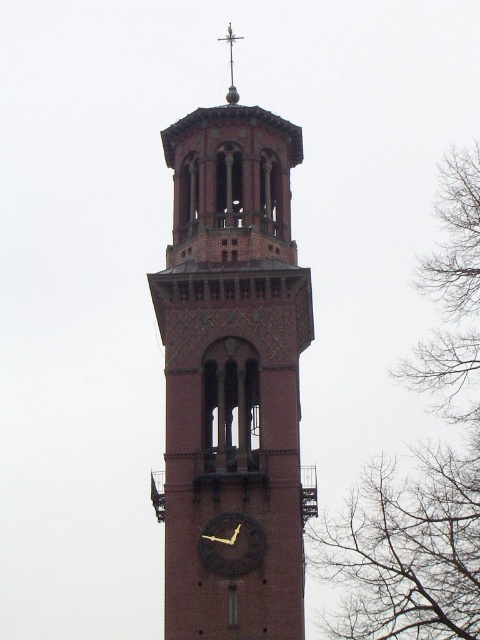
Question: Which of these objects is positioned farthest from the bare branches at right?

Choices:
 (A) brick clock tower at center
 (B) polished brass weather vane at upper center
 (C) black matte clock at center

Answer: (B)

Question: Which object appears closest to the camera in this image?

Choices:
 (A) polished brass weather vane at upper center
 (B) bare branches at right
 (C) brick clock tower at center
 (D) black matte clock at center

Answer: (C)

Question: Where is bare branches at right located in relation to polished brass weather vane at upper center in the image?

Choices:
 (A) right
 (B) left

Answer: (A)

Question: From the image, what is the correct spatial relationship of brick clock tower at center in relation to black matte clock at center?

Choices:
 (A) left
 (B) right

Answer: (B)

Question: Can you confirm if brick clock tower at center is positioned below bare branches at right?

Choices:
 (A) yes
 (B) no

Answer: (B)

Question: Which point appears closest to the camera in this image?

Choices:
 (A) (189, 252)
 (B) (229, 58)
 (C) (463, 333)
 (D) (242, 563)

Answer: (D)